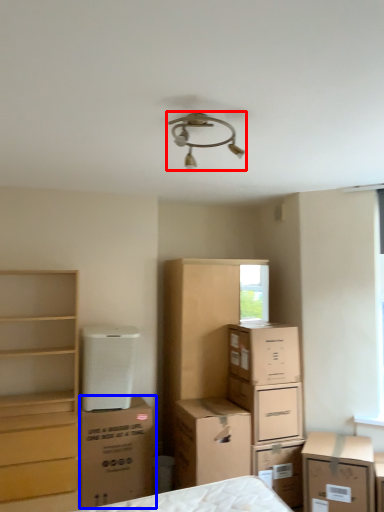
Question: Which object appears farthest to the camera in this image, lamp (highlighted by a red box) or cardboard box (highlighted by a blue box)?

Choices:
 (A) lamp
 (B) cardboard box

Answer: (B)